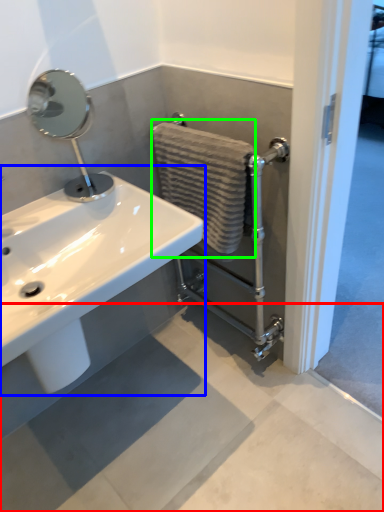
Question: Based on their relative distances, which object is farther from concrete (highlighted by a red box)? Choose from sink (highlighted by a blue box) and bath towel (highlighted by a green box).

Choices:
 (A) sink
 (B) bath towel

Answer: (B)